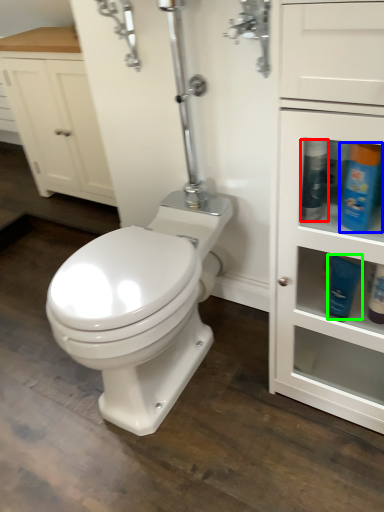
Question: Which is nearer to the cleaning product (highlighted by a red box)? cleaning product (highlighted by a blue box) or toiletry (highlighted by a green box).

Choices:
 (A) cleaning product
 (B) toiletry

Answer: (A)